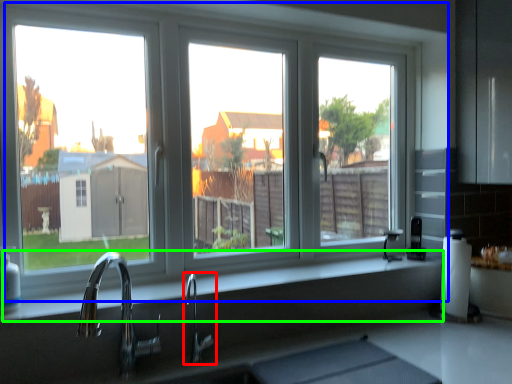
Question: Which object is the closest to the tap (highlighted by a red box)? Choose among these: window (highlighted by a blue box) or counter top (highlighted by a green box).

Choices:
 (A) window
 (B) counter top

Answer: (B)